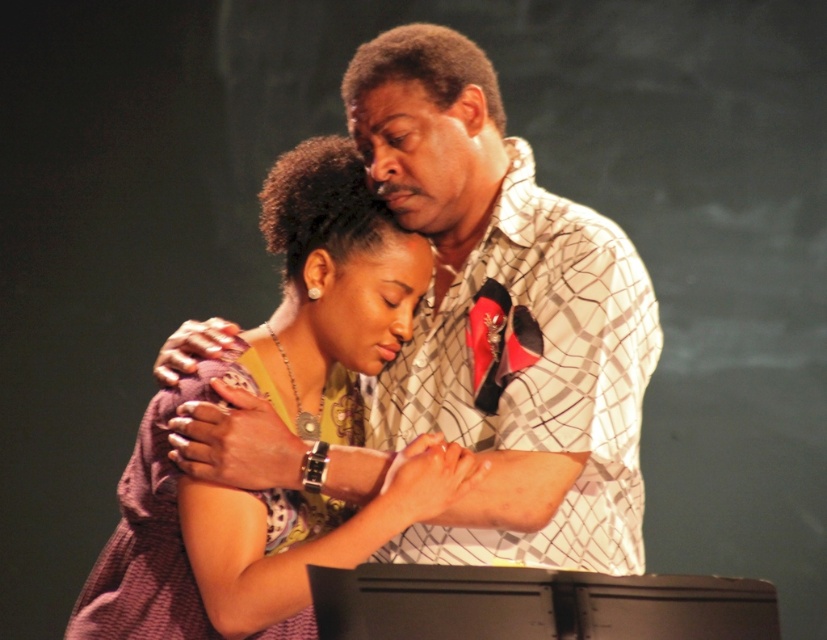
What do you see at coordinates (465, 333) in the screenshot? The image size is (827, 640). I see `white checkered shirt at upper center` at bounding box center [465, 333].

Does white checkered shirt at upper center lie in front of purple fabric dress at center?

That is False.

Image resolution: width=827 pixels, height=640 pixels. I want to click on white checkered shirt at upper center, so click(x=465, y=333).